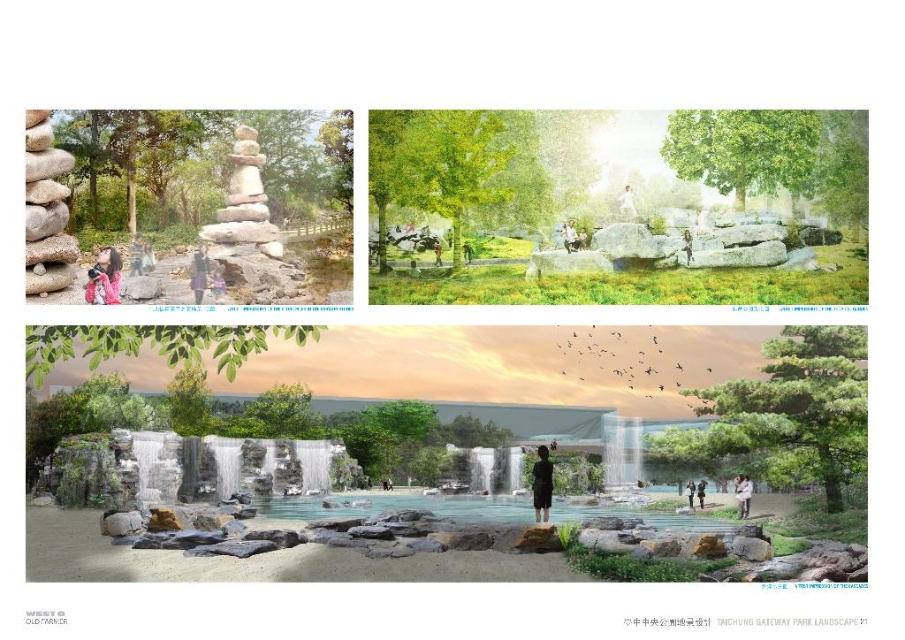
Which is above, matte pink jacket at left or brown leather jacket at center?

matte pink jacket at left

Does matte pink jacket at left have a greater width compared to brown leather jacket at center?

In fact, matte pink jacket at left might be narrower than brown leather jacket at center.

Identify the location of matte pink jacket at left. The image size is (905, 640). (135, 253).

Where is `matte pink jacket at left`? This screenshot has width=905, height=640. matte pink jacket at left is located at coordinates (135, 253).

Measure the distance between light beige fabric coat at center and camera.

light beige fabric coat at center is 21.77 meters away from camera.

Between light beige fabric coat at center and light brown wooden bench at upper center, which one appears on the right side from the viewer's perspective?

light beige fabric coat at center is more to the right.

Which is behind, point (741, 502) or point (561, 227)?

Point (741, 502)

Identify the location of light beige fabric coat at center. The height and width of the screenshot is (640, 905). (742, 493).

Is smooth gray rocks at center behind dark gray fabric umbrella at center?

No, smooth gray rocks at center is in front of dark gray fabric umbrella at center.

Does smooth gray rocks at center have a smaller size compared to dark gray fabric umbrella at center?

No.

Is point (500, 531) closer to camera compared to point (702, 492)?

Yes, it is.

Identify the location of smooth gray rocks at center. click(x=356, y=516).